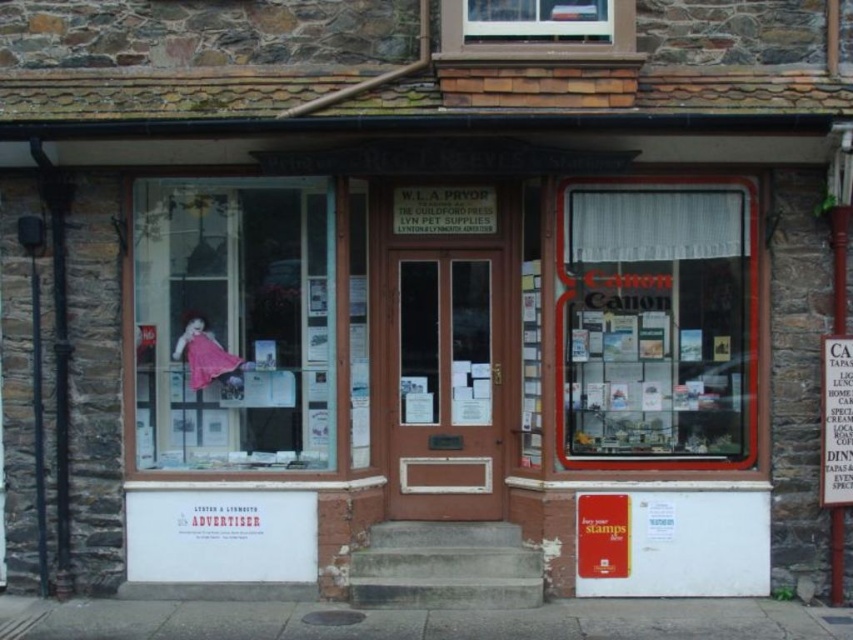
Is clear glass window at center shorter than clear glass window at upper center?

In fact, clear glass window at center may be taller than clear glass window at upper center.

Is clear glass window at center thinner than clear glass window at upper center?

No.

The width and height of the screenshot is (853, 640). Identify the location of clear glass window at center. (656, 323).

Is pink fabric dress at left behind clear glass window at upper center?

Yes.

Can you confirm if pink fabric dress at left is wider than clear glass window at upper center?

Indeed, pink fabric dress at left has a greater width compared to clear glass window at upper center.

Identify the location of pink fabric dress at left. The image size is (853, 640). (233, 323).

Can you confirm if clear glass window at upper center is positioned above metallic silver sign at right?

Correct, clear glass window at upper center is located above metallic silver sign at right.

Can you confirm if clear glass window at upper center is bigger than metallic silver sign at right?

Correct, clear glass window at upper center is larger in size than metallic silver sign at right.

You are a GUI agent. You are given a task and a screenshot of the screen. Output one action in this format:
    pyautogui.click(x=<x>, y=<y>)
    Task: Click on the clear glass window at upper center
    The height and width of the screenshot is (640, 853).
    Given the screenshot: What is the action you would take?
    pyautogui.click(x=537, y=29)

This screenshot has width=853, height=640. Identify the location of clear glass window at upper center. (537, 29).